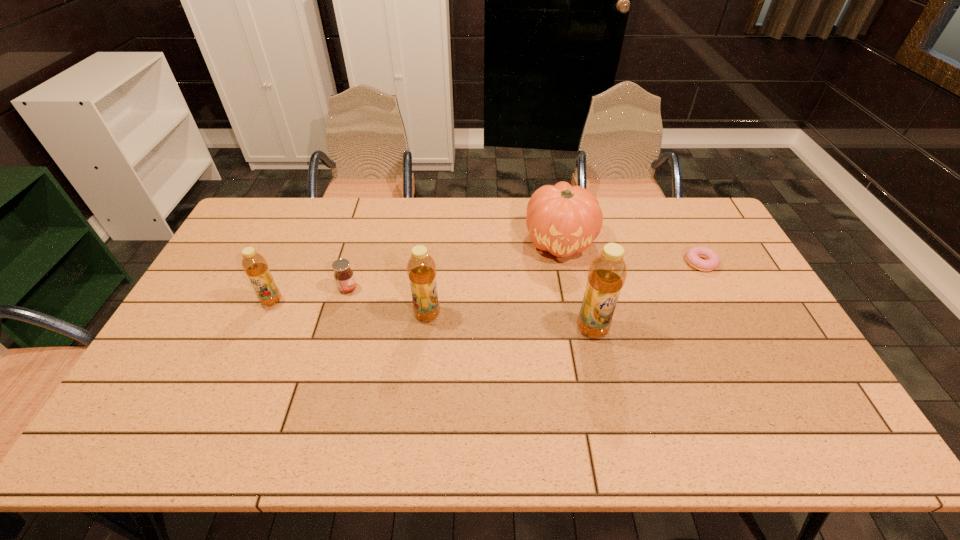
Please point a spot on the right to add another bottle. Please provide its 2D coordinates. Your answer should be formatted as a tuple, i.e. [(x, y)], where the tuple contains the x and y coordinates of a point satisfying the conditions above.

[(767, 344)]